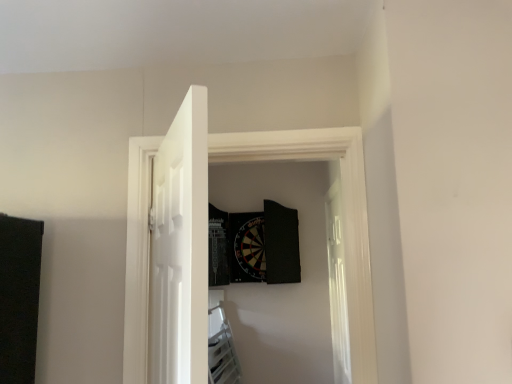
The width and height of the screenshot is (512, 384). Describe the element at coordinates (180, 248) in the screenshot. I see `white matte door at center` at that location.

Where is `white matte door at center`? Image resolution: width=512 pixels, height=384 pixels. white matte door at center is located at coordinates (180, 248).

Find the location of a particular element. The height and width of the screenshot is (384, 512). white matte door at center is located at coordinates (180, 248).